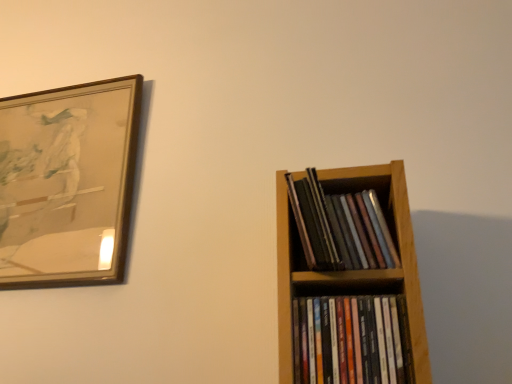
Question: From the image's perspective, is wooden picture frame at upper left above or below multicolored glossy cd cases at right, the second book in the top-to-bottom sequence?

Choices:
 (A) above
 (B) below

Answer: (A)

Question: Would you say wooden picture frame at upper left is to the left or to the right of multicolored glossy cd cases at right, which appears as the first book when ordered from the bottom, in the picture?

Choices:
 (A) left
 (B) right

Answer: (A)

Question: Which object is the farthest from the matte black books at right, marked as the 2th book in a bottom-to-top arrangement?

Choices:
 (A) multicolored glossy cd cases at right, which appears as the first book when ordered from the bottom
 (B) wooden picture frame at upper left

Answer: (B)

Question: Which object is the closest to the matte black books at right, marked as the 2th book in a bottom-to-top arrangement?

Choices:
 (A) multicolored glossy cd cases at right, the second book in the top-to-bottom sequence
 (B) wooden picture frame at upper left

Answer: (A)